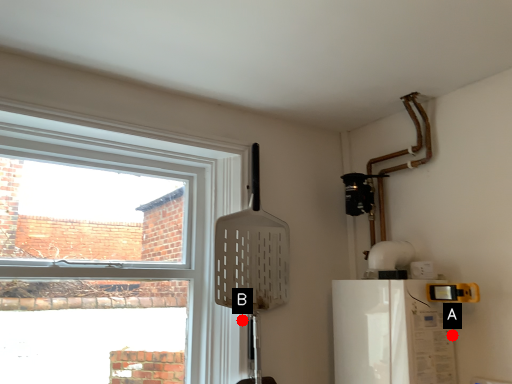
Question: Two points are circled on the image, labeled by A and B beside each circle. Which of the following is the farthest from the observer?

Choices:
 (A) A is further
 (B) B is further

Answer: (B)